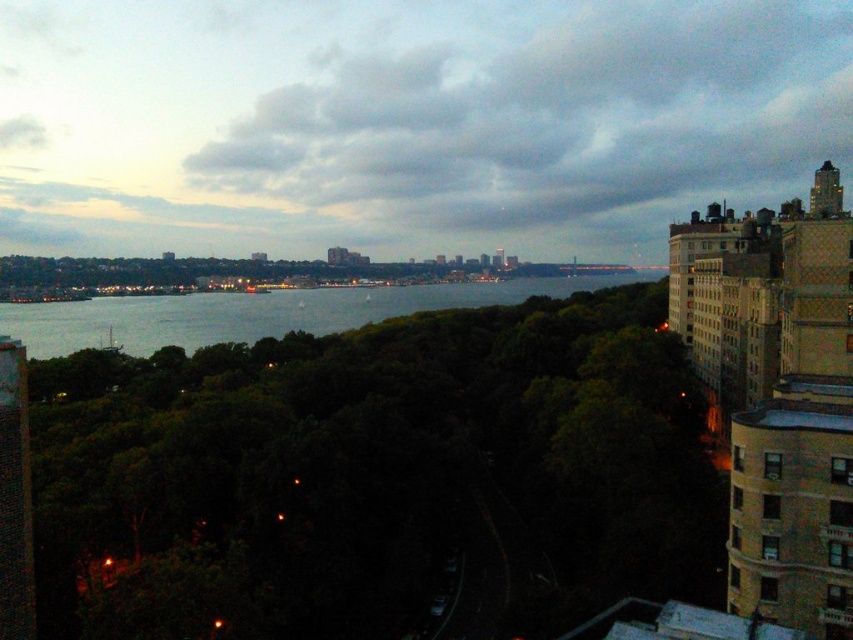
Question: Can you confirm if cloudy sky at upper center is wider than gray water at center?

Choices:
 (A) yes
 (B) no

Answer: (A)

Question: Which point is closer to the camera?

Choices:
 (A) gray water at center
 (B) cloudy sky at upper center

Answer: (B)

Question: Which of the following is the farthest from the observer?

Choices:
 (A) gray water at center
 (B) cloudy sky at upper center

Answer: (A)

Question: From the image, what is the correct spatial relationship of cloudy sky at upper center in relation to gray water at center?

Choices:
 (A) below
 (B) above

Answer: (B)

Question: Does cloudy sky at upper center have a larger size compared to gray water at center?

Choices:
 (A) no
 (B) yes

Answer: (B)